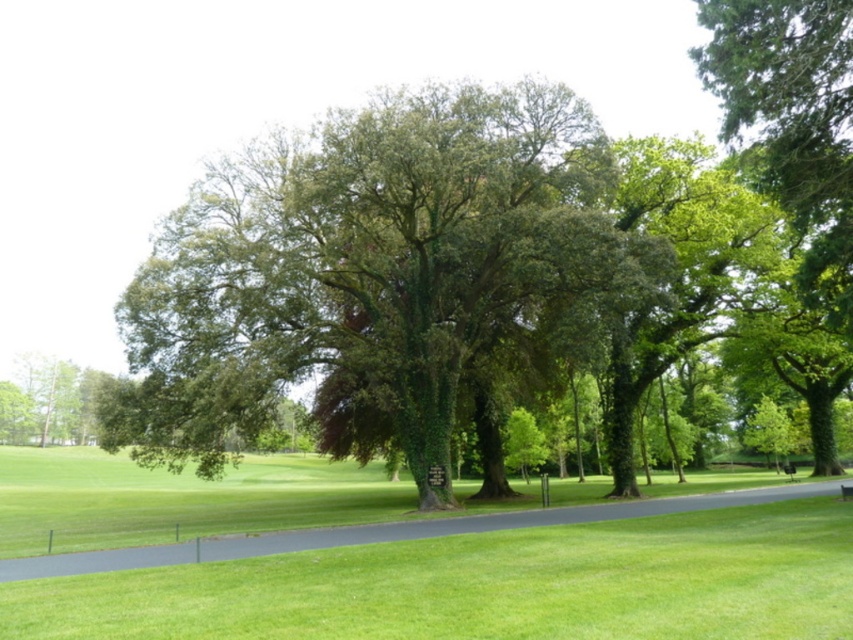
Based on the photo, you are a gardener planning to plant a new flower bed between the green leafy tree at upper right and the black asphalt path at center. Based on their positions, which side of the path should you choose to place the flower bed?

The green leafy tree at upper right is to the right of the black asphalt path at center, so the flower bed should be placed on the right side of the path to be between them.